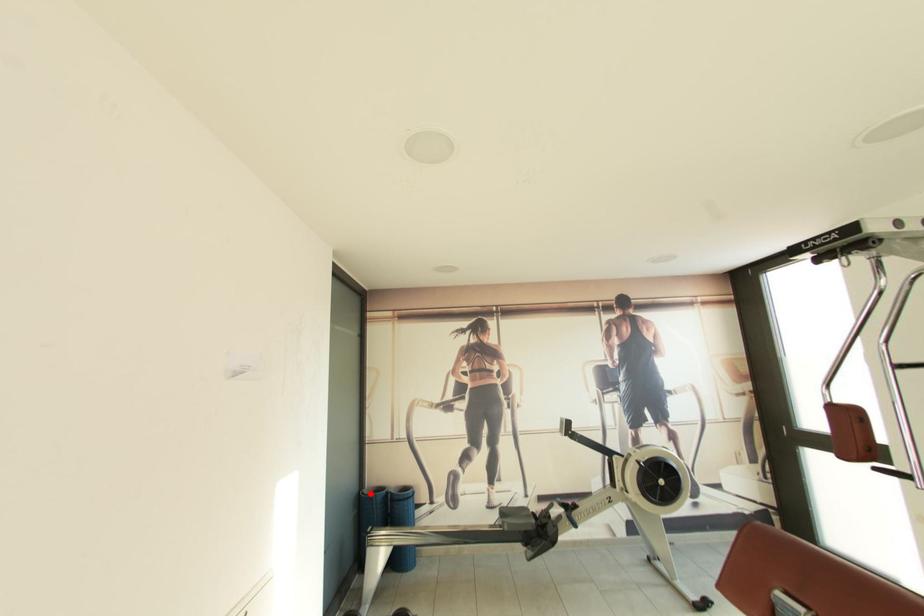
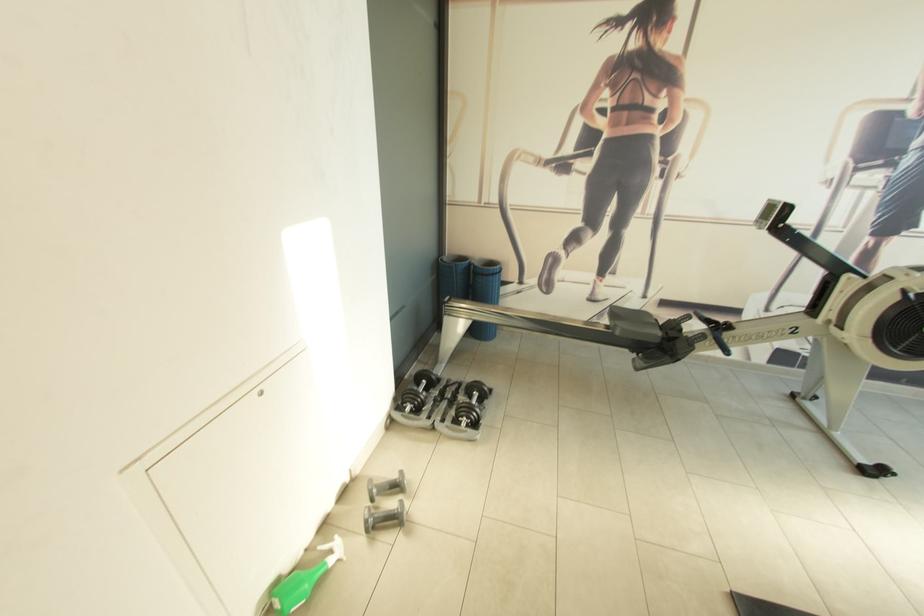
Where in the second image is the point corresponding to the highlighted location from the first image?

(451, 261)